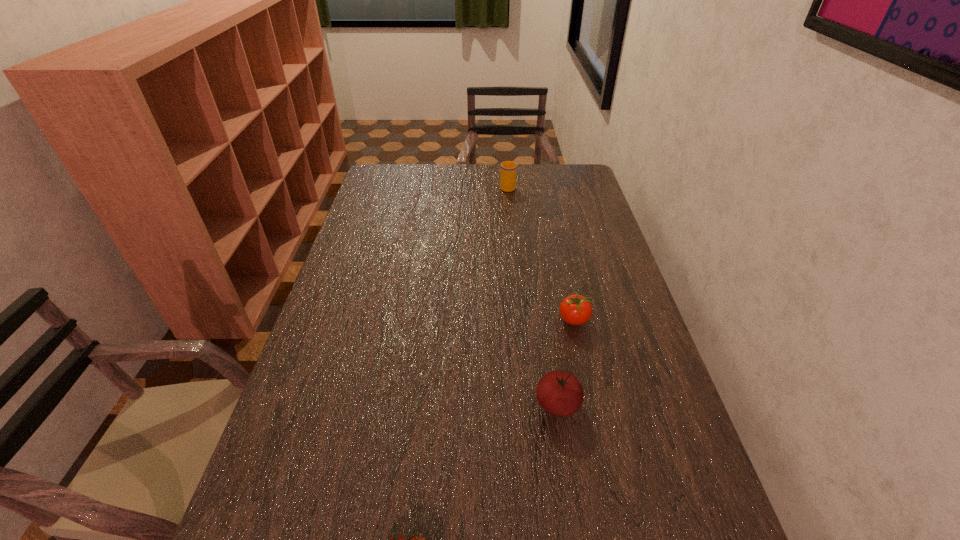
This screenshot has width=960, height=540. I want to click on tomato that stands as the closest to the tallest tomato, so click(x=575, y=309).

Where is `tomato identified as the third closest to the cup`? tomato identified as the third closest to the cup is located at coordinates (410, 539).